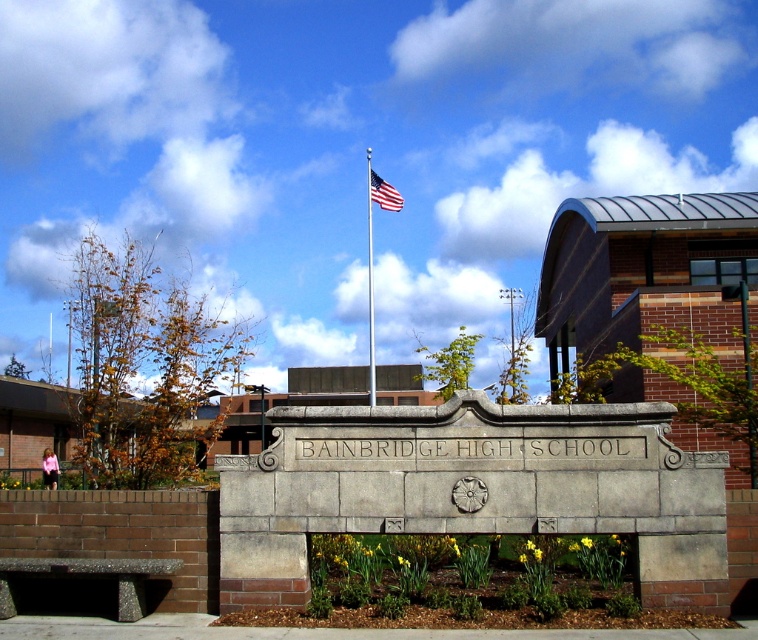
Measure the distance from polished metal flag pole at center to american flag at center.

They are 2.40 meters apart.

Looking at this image, which is above, polished metal flag pole at center or american flag at center?

Positioned higher is american flag at center.

The image size is (758, 640). What do you see at coordinates (370, 285) in the screenshot? I see `polished metal flag pole at center` at bounding box center [370, 285].

You are a GUI agent. You are given a task and a screenshot of the screen. Output one action in this format:
    pyautogui.click(x=<x>, y=<y>)
    Task: Click on the polished metal flag pole at center
    The width and height of the screenshot is (758, 640).
    Given the screenshot: What is the action you would take?
    pyautogui.click(x=370, y=285)